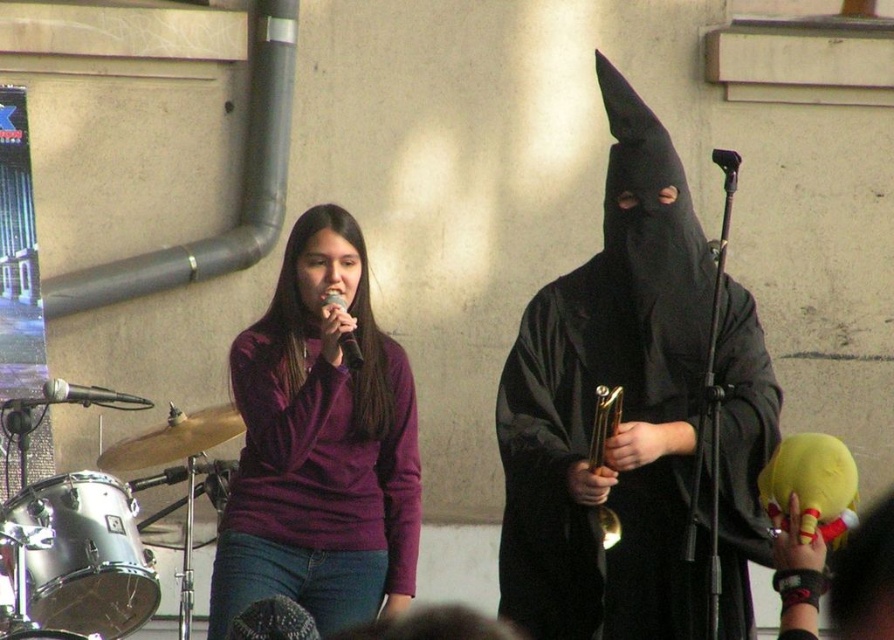
You are a stagehand setting up for a performance. You need to place a new prop between the black matte cloak at center and the metallic silver microphone at left. Based on their positions, where should you position the prop so it is between them?

The prop should be placed between the black matte cloak at center and the metallic silver microphone at left, positioned to the right of the microphone and to the left of the cloak since the cloak is to the right of the microphone.

You are an event planner trying to set up a stage layout. The stage has a coordinate system where the bottom left corner is at point 0,0 and the top right corner is at 1,1. You need to place a spotlight at position 0.6, 0.7. Will the spotlight shine on the black matte cloak at center?

The black matte cloak at center is located at point (622, 408). The spotlight is at (625, 384). Since the coordinates are close, the spotlight will shine on the black matte cloak at center.